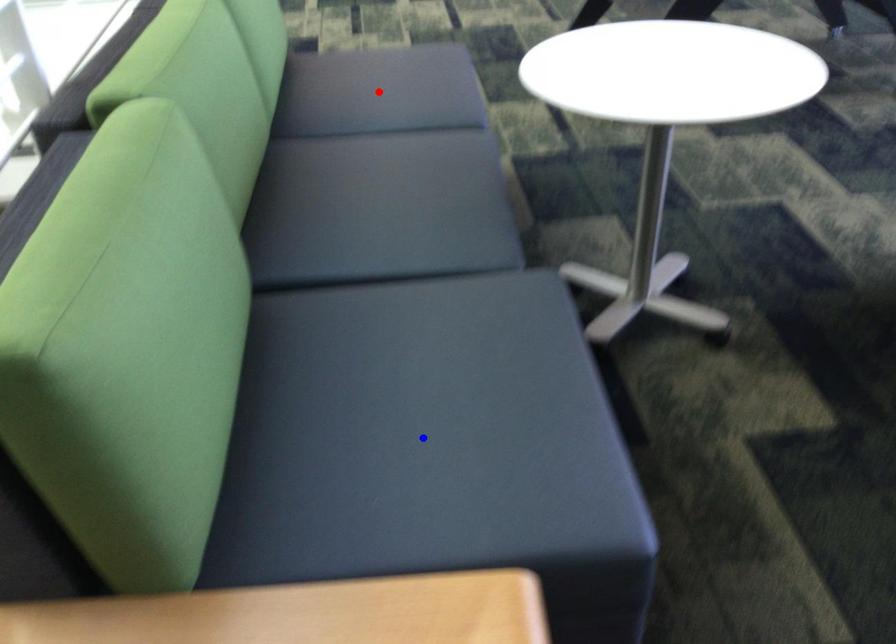
Question: Two points are marked on the image. Which point is closer to the camera?

Choices:
 (A) Blue point is closer.
 (B) Red point is closer.

Answer: (A)